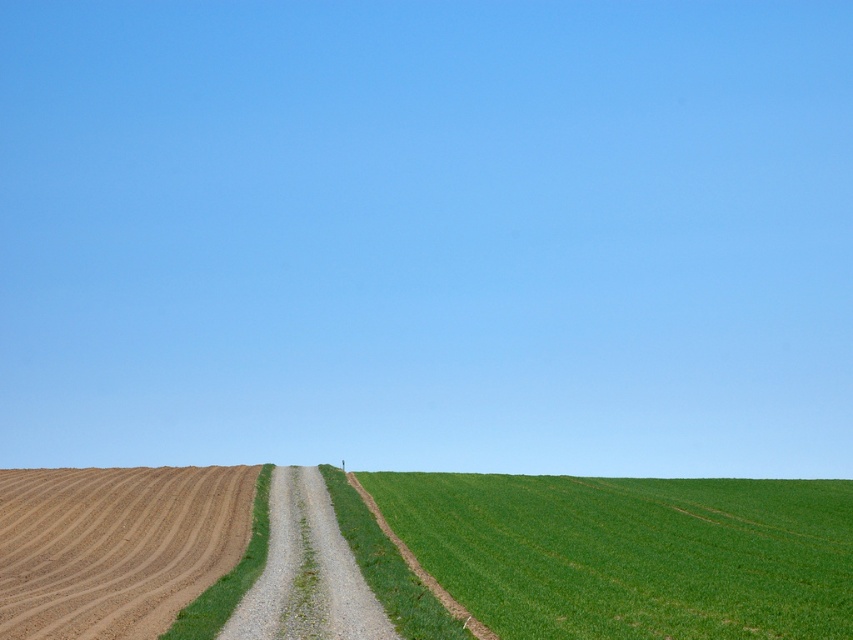
You are standing on the gravelly dirt path at center and want to walk towards the green grass at lower right. In which direction should you head?

You should head to the right because the green grass at lower right is located to the right of the gravelly dirt path at center.

You are standing at the point labeled as point [115,545] in the image. Looking towards the horizon, which direction would you face to see the brown gravel road at lower left?

The point labeled as point [115,545] indicates the brown gravel road at lower left, so if you are standing there, facing the horizon, you would be facing away from the road. To see the brown gravel road at lower left, you would need to turn around and look behind you.